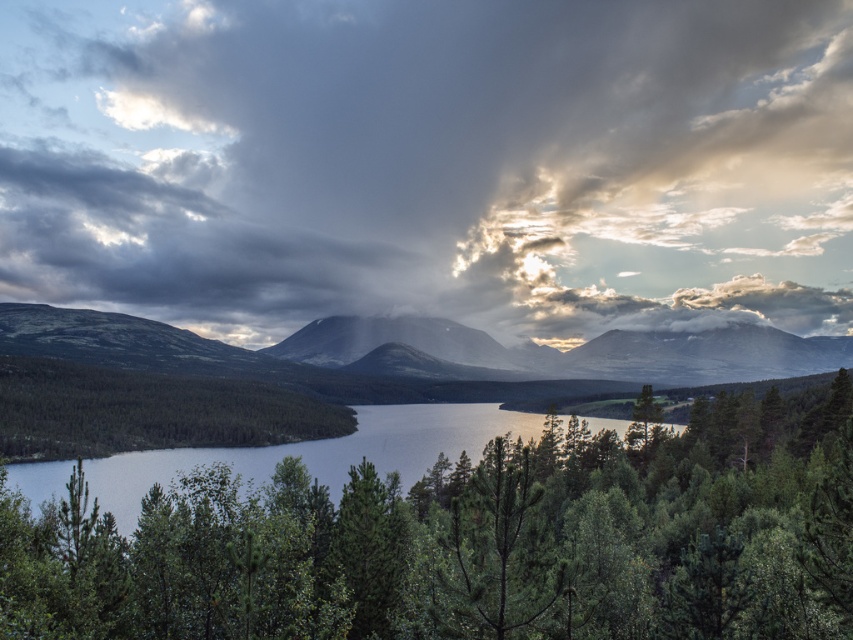
Question: Which point is farther to the camera?

Choices:
 (A) (30, 470)
 (B) (704, 376)
 (C) (845, 428)
 (D) (134, 273)

Answer: (D)

Question: Which of the following is the closest to the observer?

Choices:
 (A) green leafy tree at center
 (B) smooth gray mountain at center
 (C) cloudy sky at center
 (D) greenish-blue water at center

Answer: (A)

Question: Does green leafy tree at center have a smaller size compared to smooth gray mountain at center?

Choices:
 (A) no
 (B) yes

Answer: (B)

Question: Which of the following is the closest to the observer?

Choices:
 (A) [781, 323]
 (B) [61, 314]

Answer: (B)

Question: Can you confirm if smooth gray mountain at center is positioned to the left of greenish-blue water at center?

Choices:
 (A) yes
 (B) no

Answer: (B)

Question: Is green leafy tree at center positioned at the back of greenish-blue water at center?

Choices:
 (A) no
 (B) yes

Answer: (A)